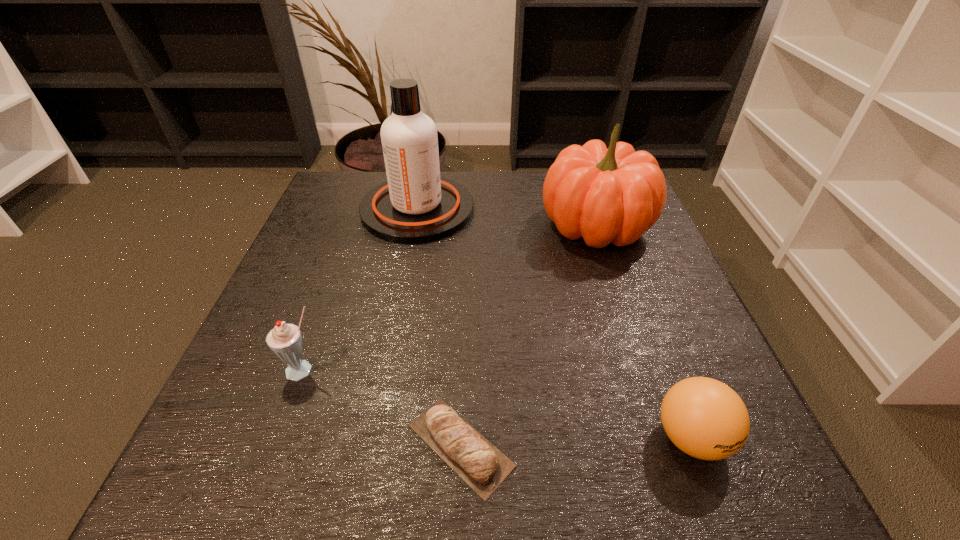
Locate an element on the screen. This screenshot has height=540, width=960. free space that satisfies the following two spatial constraints: 1. on the front side of the tallest object; 2. on the left side of the pumpkin is located at coordinates (415, 226).